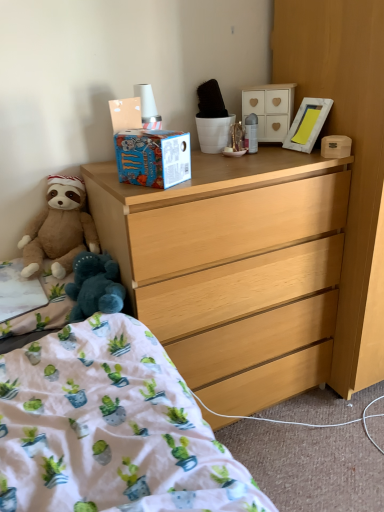
Question: Can we say brown plush teddy bear at left lies outside light wood dresser at center, which appears as the second cabinetry when viewed from the left?

Choices:
 (A) yes
 (B) no

Answer: (A)

Question: Can you confirm if brown plush teddy bear at left is thinner than light wood dresser at center, the first cabinetry positioned from the right?

Choices:
 (A) yes
 (B) no

Answer: (A)

Question: Is brown plush teddy bear at left taller than light wood dresser at center, which appears as the second cabinetry when viewed from the left?

Choices:
 (A) yes
 (B) no

Answer: (B)

Question: Is light wood dresser at center, which appears as the second cabinetry when viewed from the left, at the back of brown plush teddy bear at left?

Choices:
 (A) yes
 (B) no

Answer: (B)

Question: Is brown plush teddy bear at left in contact with light wood dresser at center, acting as the 2th cabinetry starting from the top?

Choices:
 (A) yes
 (B) no

Answer: (B)

Question: Does brown plush teddy bear at left lie in front of light wood dresser at center, which appears as the second cabinetry when viewed from the left?

Choices:
 (A) yes
 (B) no

Answer: (B)

Question: Does white fabric at lower left, the 1th sheet from the bottom, appear on the left side of light wood dresser at center?

Choices:
 (A) no
 (B) yes

Answer: (B)

Question: Is the surface of white fabric at lower left, marked as the second sheet in a top-to-bottom arrangement, in direct contact with light wood dresser at center?

Choices:
 (A) yes
 (B) no

Answer: (B)

Question: From a real-world perspective, is white fabric at lower left, the 1th sheet from the bottom, located higher than light wood dresser at center?

Choices:
 (A) yes
 (B) no

Answer: (A)

Question: Can you confirm if white fabric at lower left, the 1th sheet from the bottom, is positioned to the right of light wood dresser at center?

Choices:
 (A) yes
 (B) no

Answer: (B)

Question: Could you tell me if white fabric at lower left, marked as the second sheet in a top-to-bottom arrangement, is turned towards light wood dresser at center?

Choices:
 (A) no
 (B) yes

Answer: (A)

Question: Is white fabric at lower left, marked as the second sheet in a top-to-bottom arrangement, not inside light wood dresser at center?

Choices:
 (A) no
 (B) yes

Answer: (B)

Question: From the image's perspective, is white matte cabinet at upper center, placed as the first cabinetry when sorted from top to bottom, beneath white cotton bed at lower left?

Choices:
 (A) yes
 (B) no

Answer: (B)